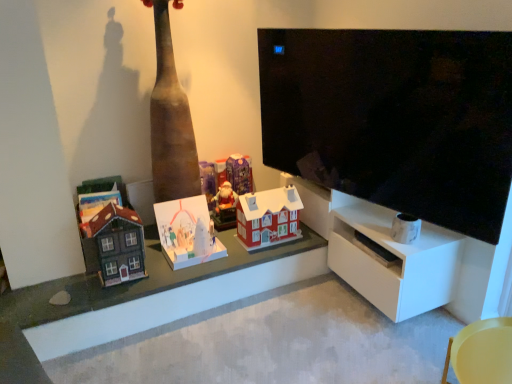
Locate an element on the screen. The height and width of the screenshot is (384, 512). free spot to the left of matte brown wooden house at left, which appears as the 5th toy when viewed from the right is located at coordinates (85, 279).